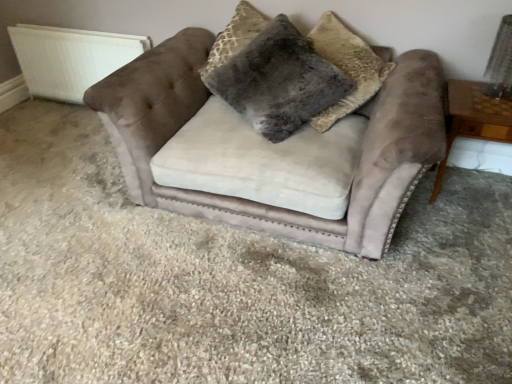
I want to click on vacant area that is in front of wooden side table at right, so click(469, 246).